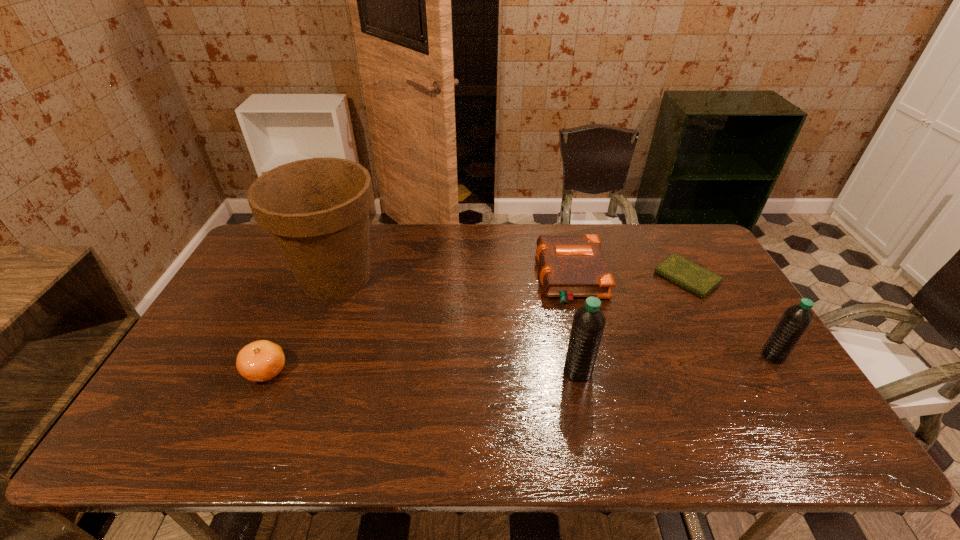
The width and height of the screenshot is (960, 540). I want to click on object that stands as the fourth closest to the second tallest object, so click(x=317, y=210).

Where is `vacant area that satisfies the following two spatial constraints: 1. on the spine side of the fifth tallest object; 2. on the front side of the second tallest object`? vacant area that satisfies the following two spatial constraints: 1. on the spine side of the fifth tallest object; 2. on the front side of the second tallest object is located at coordinates (593, 371).

Locate an element on the screen. free point that satisfies the following two spatial constraints: 1. on the front side of the second tallest object; 2. on the left side of the flowerpot is located at coordinates (300, 371).

Identify the location of vacant point that satisfies the following two spatial constraints: 1. on the back side of the diary; 2. on the spine side of the fifth tallest object. (686, 276).